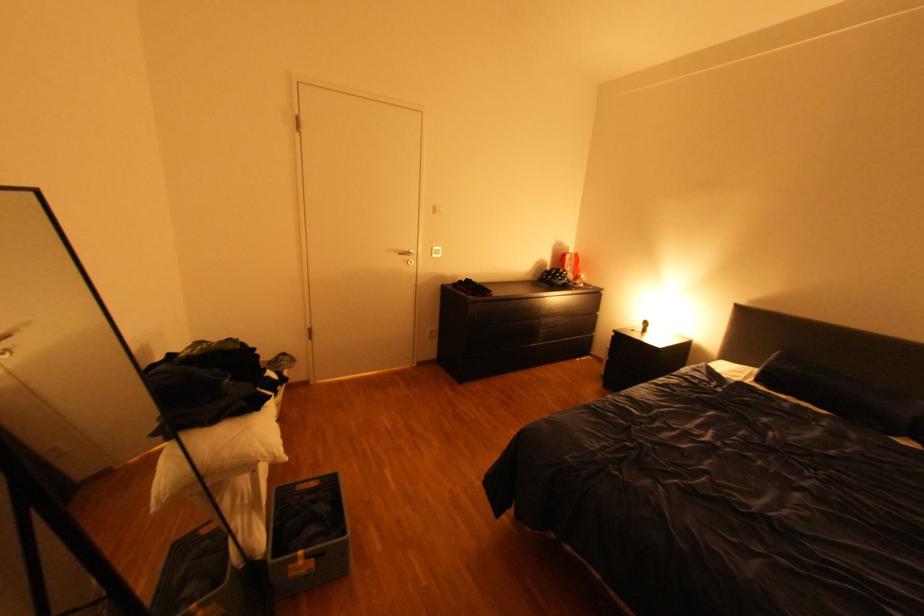
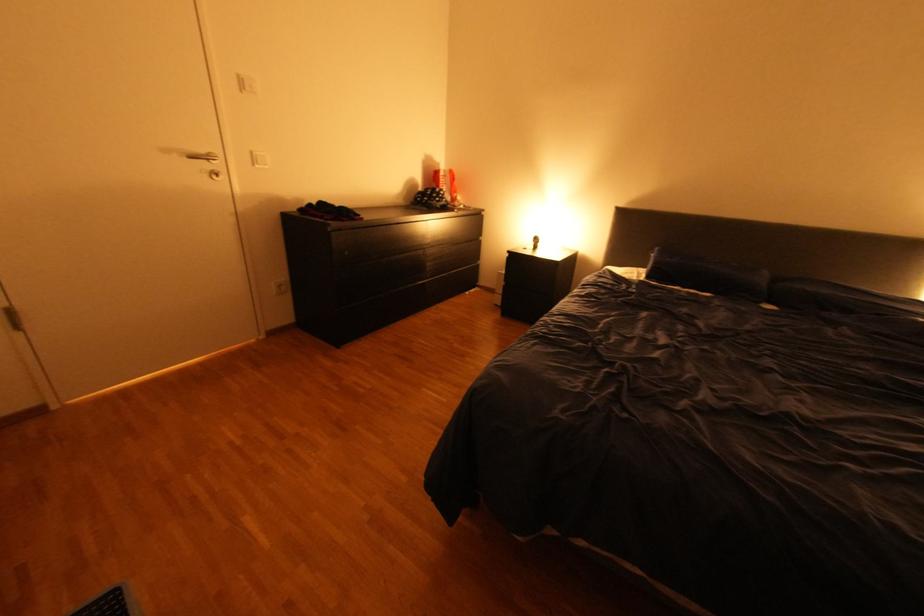
Locate, in the second image, the point that corresponds to (444,214) in the first image.

(251, 91)